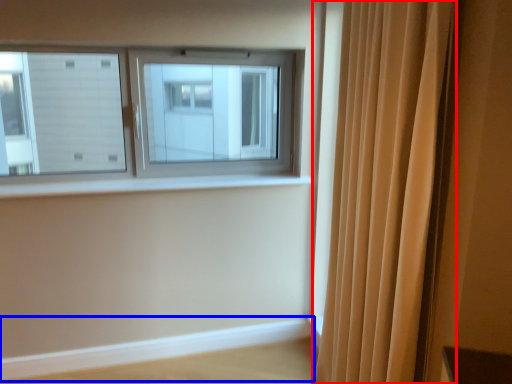
Question: Among these objects, which one is farthest to the camera, curtain (highlighted by a red box) or ledge (highlighted by a blue box)?

Choices:
 (A) curtain
 (B) ledge

Answer: (B)